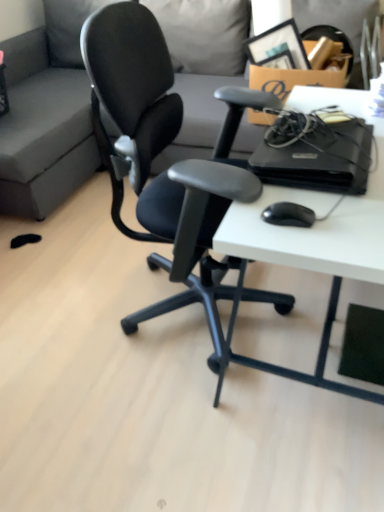
Locate an element on the screen. The image size is (384, 512). free space in front of black plastic computer at right is located at coordinates (318, 221).